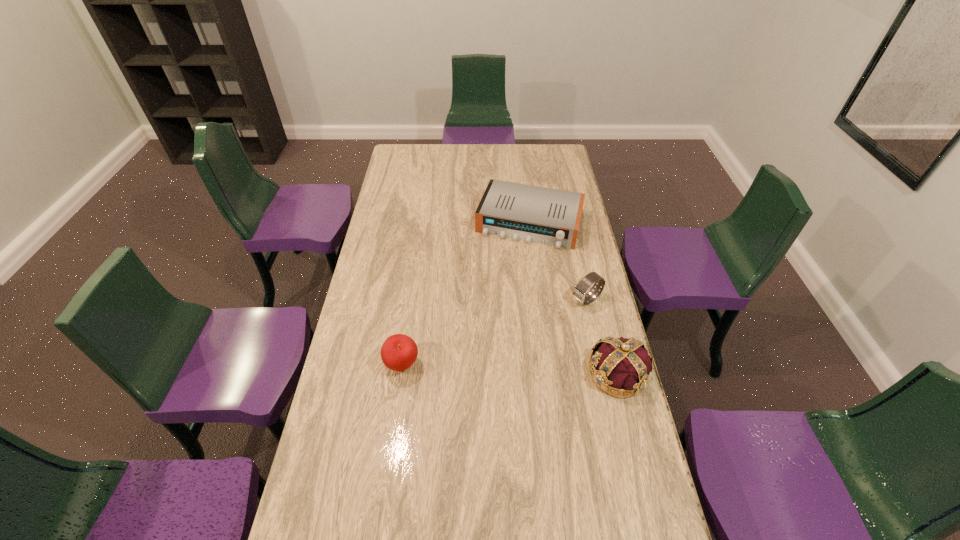
Identify the location of free space located 0.100m on the control panel of the shortest object. The height and width of the screenshot is (540, 960). (513, 266).

At what (x,y) coordinates should I click in order to perform the action: click on vacant space situated 0.390m on the control panel of the shortest object. Please return your answer as a coordinate pair (x, y). Looking at the image, I should click on (494, 322).

Image resolution: width=960 pixels, height=540 pixels. Find the location of `vacant space located 0.330m on the control panel of the shortest object`. vacant space located 0.330m on the control panel of the shortest object is located at coordinates (498, 309).

Where is `object located at the left edge`? object located at the left edge is located at coordinates (398, 352).

The height and width of the screenshot is (540, 960). I want to click on crown that is at the right edge, so click(621, 367).

Where is `watch present at the right edge`? watch present at the right edge is located at coordinates (579, 292).

Locate an element on the screen. This screenshot has height=540, width=960. radio receiver that is at the right edge is located at coordinates (548, 216).

Where is `vacant space at the far edge of the desktop`? Image resolution: width=960 pixels, height=540 pixels. vacant space at the far edge of the desktop is located at coordinates (437, 153).

In the image, there is a desktop. In order to click on vacant space at the left edge in this screenshot , I will do pyautogui.click(x=372, y=372).

Where is `free space at the right edge of the desktop`? Image resolution: width=960 pixels, height=540 pixels. free space at the right edge of the desktop is located at coordinates (576, 369).